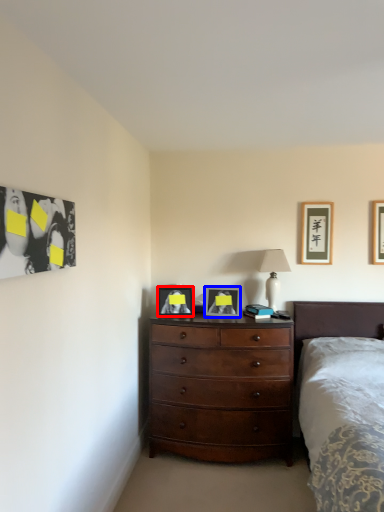
Question: Which object appears farthest to the camera in this image, picture frame (highlighted by a red box) or picture frame (highlighted by a blue box)?

Choices:
 (A) picture frame
 (B) picture frame

Answer: (A)